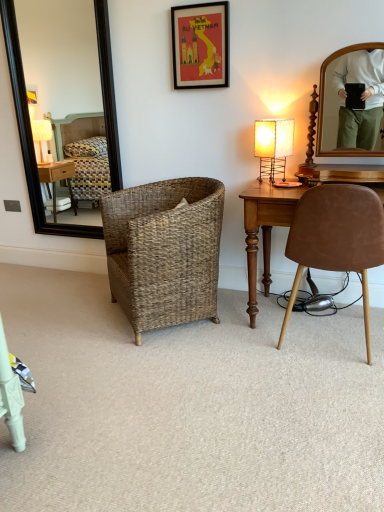
Where is `free space in front of brown suede chair at right, arranged as the first chair when viewed from the right`? This screenshot has height=512, width=384. free space in front of brown suede chair at right, arranged as the first chair when viewed from the right is located at coordinates (329, 390).